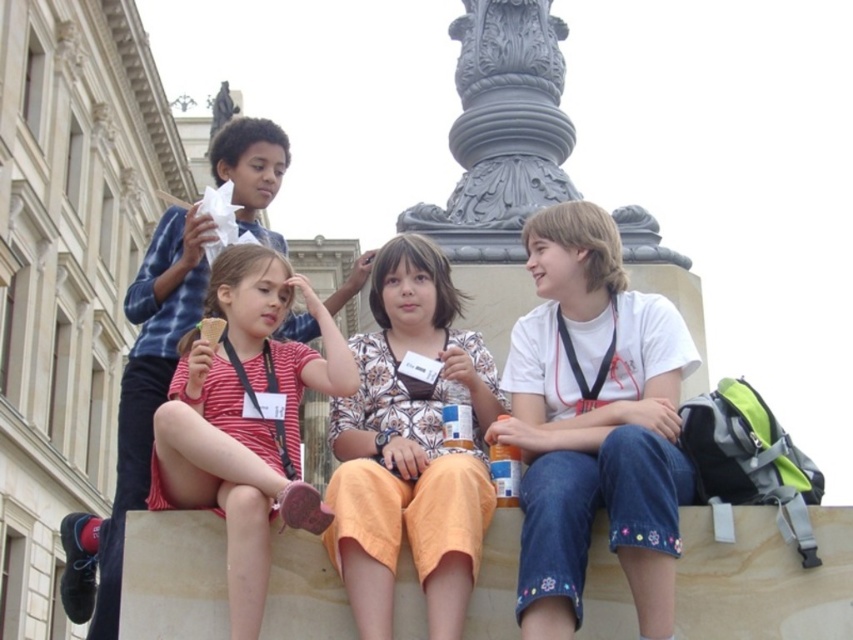
Question: Considering the real-world distances, which object is farthest from the gray stone column at center?

Choices:
 (A) striped cotton shirt at center
 (B) white cotton shirt at center

Answer: (A)

Question: Does floral-patterned shirt at center have a smaller size compared to gray stone column at center?

Choices:
 (A) no
 (B) yes

Answer: (B)

Question: Which point is farther to the camera?

Choices:
 (A) striped cotton shirt at center
 (B) gray stone column at center
 (C) white cotton shirt at center

Answer: (B)

Question: Can you confirm if white cotton shirt at center is positioned above striped cotton shirt at center?

Choices:
 (A) yes
 (B) no

Answer: (A)

Question: Which object is positioned farthest from the striped cotton shirt at center?

Choices:
 (A) white cotton shirt at center
 (B) gray stone column at center

Answer: (B)

Question: Does striped cotton shirt at center appear on the left side of gray stone column at center?

Choices:
 (A) yes
 (B) no

Answer: (A)